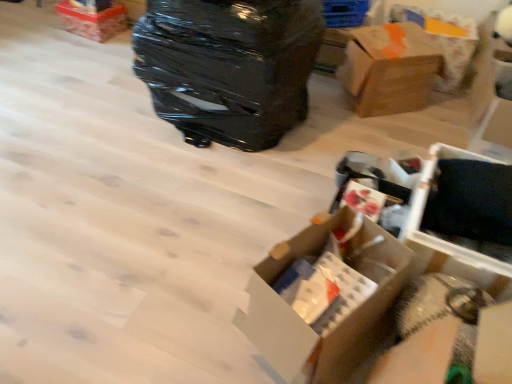
Locate an element on the screen. The height and width of the screenshot is (384, 512). vacant space that is to the left of brown cardboard box at upper right, the 2th box when ordered from top to bottom is located at coordinates (322, 103).